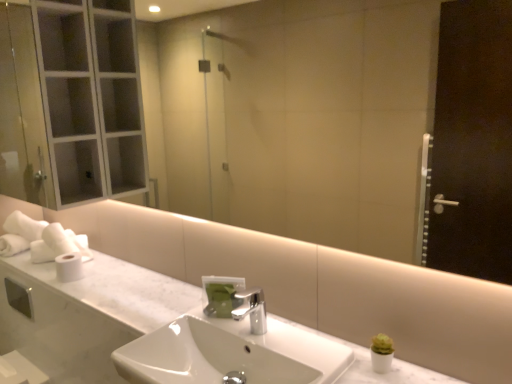
Question: Can you confirm if polished metallic faucet at center is thinner than white matte toilet paper at left, which ranks as the 1th toilet paper in front-to-back order?

Choices:
 (A) no
 (B) yes

Answer: (A)

Question: Does polished metallic faucet at center come behind white matte toilet paper at left, which ranks as the 1th toilet paper in front-to-back order?

Choices:
 (A) yes
 (B) no

Answer: (B)

Question: From a real-world perspective, is polished metallic faucet at center over white matte toilet paper at left, which ranks as the 1th toilet paper in front-to-back order?

Choices:
 (A) no
 (B) yes

Answer: (B)

Question: Would you say white matte toilet paper at left, which ranks as the second toilet paper in back-to-front order, is part of polished metallic faucet at center's contents?

Choices:
 (A) yes
 (B) no

Answer: (B)

Question: From a real-world perspective, does polished metallic faucet at center sit lower than white matte toilet paper at left, which ranks as the 1th toilet paper in front-to-back order?

Choices:
 (A) no
 (B) yes

Answer: (A)

Question: Is green matte soap dispenser at center in front of or behind white glossy sink at center in the image?

Choices:
 (A) front
 (B) behind

Answer: (B)

Question: Considering the relative positions of green matte soap dispenser at center and white glossy sink at center in the image provided, is green matte soap dispenser at center to the left or to the right of white glossy sink at center?

Choices:
 (A) left
 (B) right

Answer: (A)

Question: Which is correct: green matte soap dispenser at center is inside white glossy sink at center, or outside of it?

Choices:
 (A) outside
 (B) inside

Answer: (A)

Question: Does point (221, 301) appear closer or farther from the camera than point (278, 375)?

Choices:
 (A) closer
 (B) farther

Answer: (B)

Question: Is point (208, 312) positioned closer to the camera than point (37, 246)?

Choices:
 (A) farther
 (B) closer

Answer: (B)

Question: Relative to white matte toilet paper at left, marked as the 2th toilet paper in a front-to-back arrangement, is green matte soap dispenser at center in front or behind?

Choices:
 (A) front
 (B) behind

Answer: (A)

Question: Is green matte soap dispenser at center wider or thinner than white matte toilet paper at left, the first toilet paper from the back?

Choices:
 (A) wide
 (B) thin

Answer: (B)

Question: Is green matte soap dispenser at center to the left or to the right of white matte toilet paper at left, marked as the 2th toilet paper in a front-to-back arrangement, in the image?

Choices:
 (A) right
 (B) left

Answer: (A)

Question: In terms of height, does white glossy sink at center look taller or shorter compared to polished metallic faucet at center?

Choices:
 (A) short
 (B) tall

Answer: (B)

Question: Is white glossy sink at center bigger or smaller than polished metallic faucet at center?

Choices:
 (A) big
 (B) small

Answer: (A)